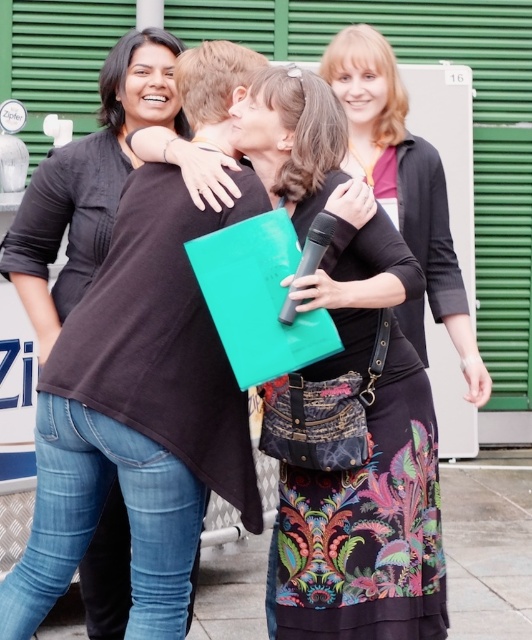
You are a photographer standing on the smooth concrete pavement at lower center and want to take a photo of the black plastic microphone at center. Can you see the microphone without bending down?

The smooth concrete pavement at lower center is much taller than the black plastic microphone at center, so you would need to bend down to see it properly.

You are a photographer at the event and want to capture a photo where the black matte shirt at left is visible without being blocked by the black plastic microphone at center. Based on the scene description, can you position yourself in a way to achieve this?

Yes, since the black matte shirt at left is above the black plastic microphone at center, positioning yourself lower or angling the camera upwards would allow the black matte shirt at left to remain visible without obstruction from the microphone.